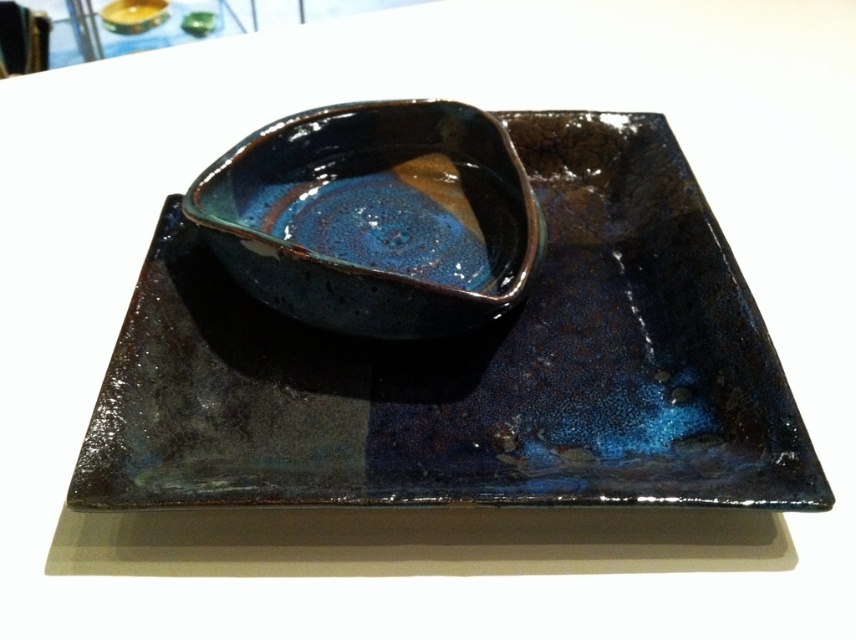
Question: Can you confirm if glossy ceramic tray at center is positioned above glossy ceramic bowl at center?

Choices:
 (A) yes
 (B) no

Answer: (B)

Question: Does glossy ceramic tray at center come in front of glossy ceramic bowl at center?

Choices:
 (A) yes
 (B) no

Answer: (A)

Question: Which object is closer to the camera taking this photo?

Choices:
 (A) glossy ceramic bowl at center
 (B) glossy ceramic tray at center

Answer: (B)

Question: Does glossy ceramic tray at center have a greater width compared to glossy ceramic bowl at center?

Choices:
 (A) yes
 (B) no

Answer: (A)